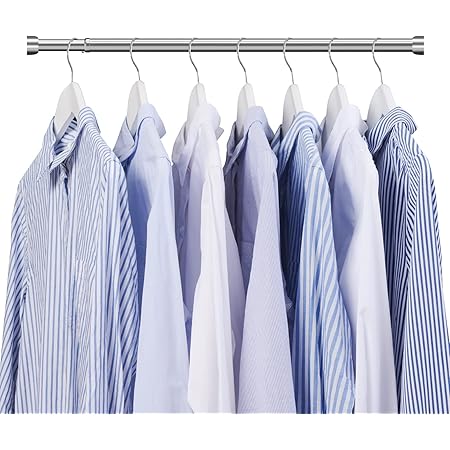
Identify the location of hangers. The image size is (450, 450). (380, 104), (338, 100), (288, 102), (243, 102), (191, 102), (130, 93), (69, 104).